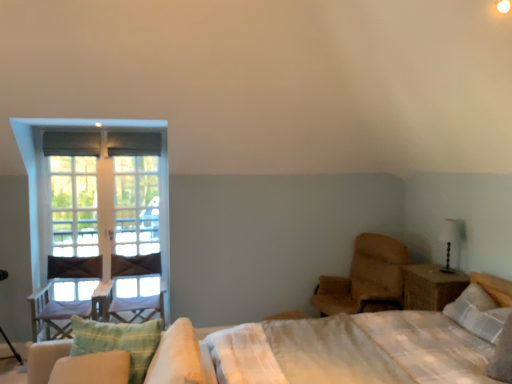
Question: Can you confirm if light beige fabric mattress at right is taller than green striped pillow at lower left, the 2th pillow viewed from the right?

Choices:
 (A) no
 (B) yes

Answer: (B)

Question: Can you confirm if light beige fabric mattress at right is wider than green striped pillow at lower left, the 2th pillow viewed from the right?

Choices:
 (A) yes
 (B) no

Answer: (A)

Question: Considering the relative sizes of light beige fabric mattress at right and green striped pillow at lower left, the 1th pillow positioned from the front, in the image provided, is light beige fabric mattress at right shorter than green striped pillow at lower left, the 1th pillow positioned from the front,?

Choices:
 (A) no
 (B) yes

Answer: (A)

Question: From the image's perspective, does light beige fabric mattress at right appear lower than green striped pillow at lower left, the 2th pillow viewed from the back?

Choices:
 (A) no
 (B) yes

Answer: (B)

Question: Considering the relative positions of light beige fabric mattress at right and green striped pillow at lower left, marked as the first pillow in a left-to-right arrangement, in the image provided, is light beige fabric mattress at right to the right of green striped pillow at lower left, marked as the first pillow in a left-to-right arrangement, from the viewer's perspective?

Choices:
 (A) yes
 (B) no

Answer: (A)

Question: Which is correct: white wooden window at left, positioned as the 1th window in right-to-left order, is inside clear glass window at left, marked as the first window in a left-to-right arrangement, or outside of it?

Choices:
 (A) inside
 (B) outside

Answer: (B)

Question: Considering the positions of point (103, 129) and point (55, 167), is point (103, 129) closer or farther from the camera than point (55, 167)?

Choices:
 (A) closer
 (B) farther

Answer: (A)

Question: From a real-world perspective, relative to clear glass window at left, the second window in the right-to-left sequence, is white wooden window at left, the 2th window from the left, vertically above or below?

Choices:
 (A) above
 (B) below

Answer: (A)

Question: Looking at the image, does white wooden window at left, the 2th window from the left, seem bigger or smaller compared to clear glass window at left, the second window in the right-to-left sequence?

Choices:
 (A) big
 (B) small

Answer: (A)

Question: Does point (443, 269) appear closer or farther from the camera than point (117, 314)?

Choices:
 (A) closer
 (B) farther

Answer: (A)

Question: From the image's perspective, is matte black table lamp at right positioned above or below wooden swivel chair at left?

Choices:
 (A) below
 (B) above

Answer: (B)

Question: Would you say matte black table lamp at right is inside or outside wooden swivel chair at left?

Choices:
 (A) outside
 (B) inside

Answer: (A)

Question: In the image, is matte black table lamp at right positioned in front of or behind wooden swivel chair at left?

Choices:
 (A) front
 (B) behind

Answer: (A)

Question: From a real-world perspective, is light beige fabric mattress at right above or below green striped pillow at lower left, marked as the first pillow in a left-to-right arrangement?

Choices:
 (A) below
 (B) above

Answer: (A)

Question: Looking at the image, does light beige fabric mattress at right seem bigger or smaller compared to green striped pillow at lower left, the 1th pillow positioned from the front?

Choices:
 (A) small
 (B) big

Answer: (B)